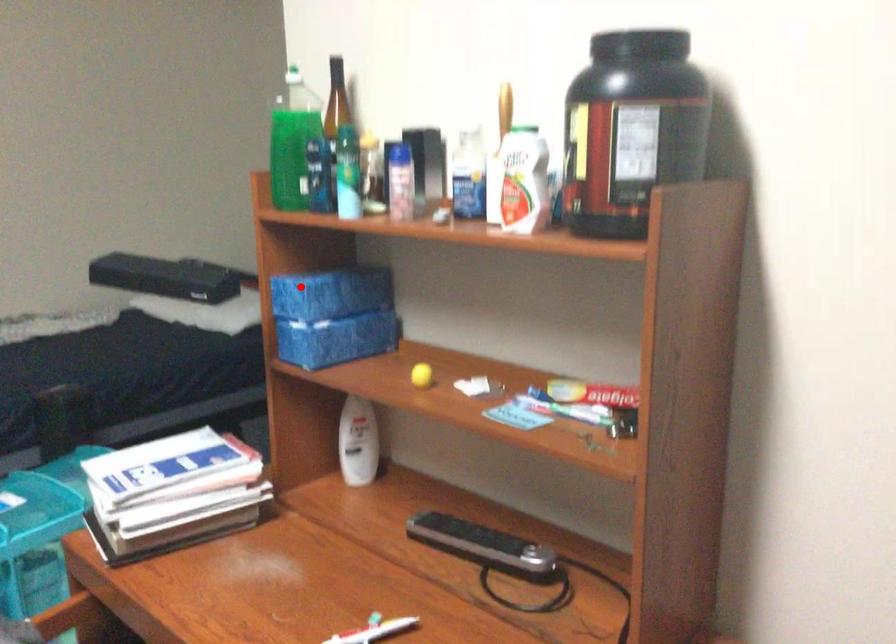
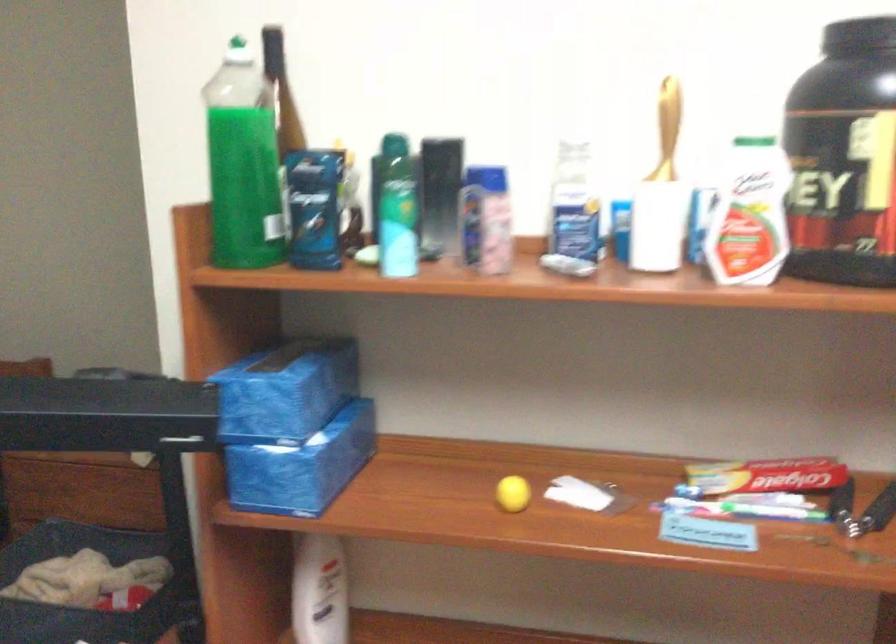
In the second image, find the point that corresponds to the highlighted location in the first image.

(286, 391)